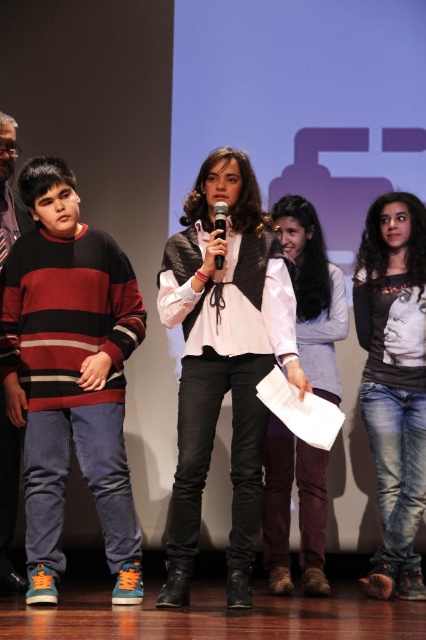
Question: Estimate the real-world distances between objects in this image. Which object is farther from the white paper at center?

Choices:
 (A) white matte vest at center
 (B) striped sweater at left
 (C) black matte shirt at right

Answer: (B)

Question: Observing the image, what is the correct spatial positioning of black matte shirt at right in reference to white paper at center?

Choices:
 (A) above
 (B) below

Answer: (A)

Question: Does white matte shirt at center appear under white paper at center?

Choices:
 (A) yes
 (B) no

Answer: (A)

Question: Among these points, which one is farthest from the camera?

Choices:
 (A) (226, 225)
 (B) (256, 262)
 (C) (114, 424)
 (D) (380, 291)

Answer: (D)

Question: Based on their relative distances, which object is farther from the striped sweater at left?

Choices:
 (A) white matte vest at center
 (B) white paper at center

Answer: (B)

Question: Is white matte vest at center positioned in front of black matte shirt at right?

Choices:
 (A) yes
 (B) no

Answer: (A)